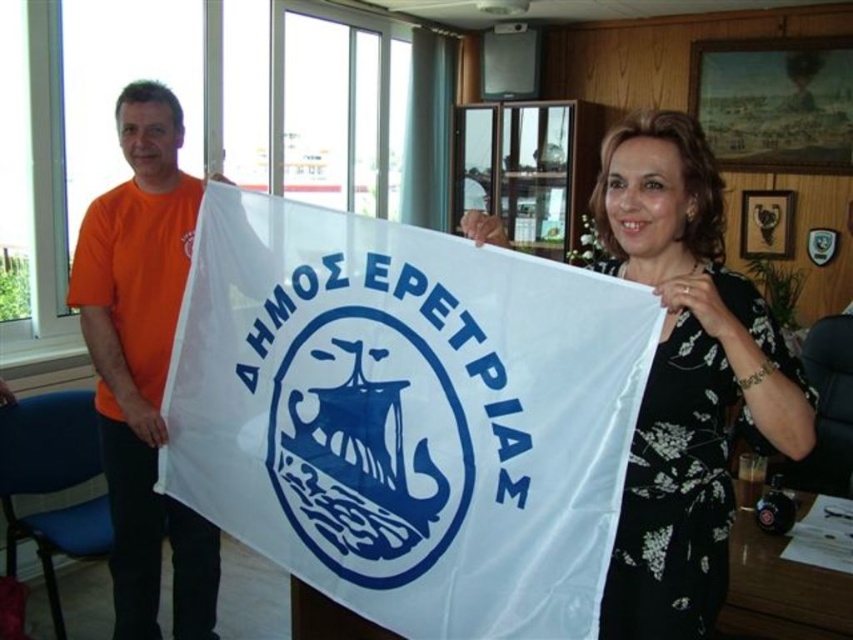
Question: Which point is closer to the camera?

Choices:
 (A) orange t-shirt at left
 (B) white floral dress at center
 (C) white fabric flag at center

Answer: (B)

Question: Among these points, which one is farthest from the camera?

Choices:
 (A) (631, 216)
 (B) (590, 460)

Answer: (A)

Question: Can you confirm if white fabric flag at center is thinner than orange t-shirt at left?

Choices:
 (A) no
 (B) yes

Answer: (A)

Question: Is white fabric flag at center bigger than orange t-shirt at left?

Choices:
 (A) yes
 (B) no

Answer: (A)

Question: Which of the following is the farthest from the observer?

Choices:
 (A) (519, 632)
 (B) (119, 262)

Answer: (B)

Question: Observing the image, what is the correct spatial positioning of white fabric flag at center in reference to white floral dress at center?

Choices:
 (A) left
 (B) right

Answer: (A)